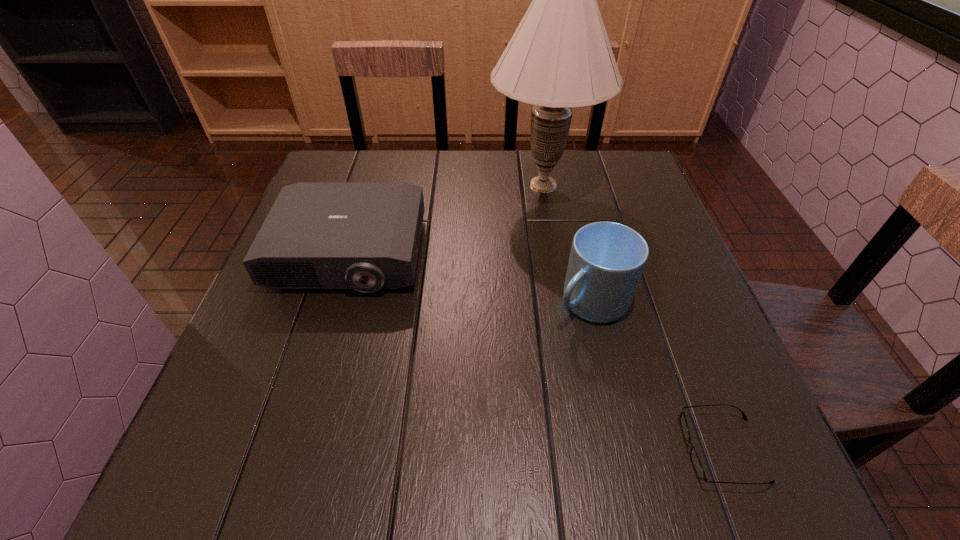
Where is `free spot that satisfies the following two spatial constraints: 1. on the front-facing side of the projector; 2. on the right side of the mug`? free spot that satisfies the following two spatial constraints: 1. on the front-facing side of the projector; 2. on the right side of the mug is located at coordinates (335, 302).

You are a GUI agent. You are given a task and a screenshot of the screen. Output one action in this format:
    pyautogui.click(x=<x>, y=<y>)
    Task: Click on the blank space that satisfies the following two spatial constraints: 1. on the front side of the mug; 2. on the right side of the lampshade
    This screenshot has width=960, height=540.
    Given the screenshot: What is the action you would take?
    pyautogui.click(x=564, y=302)

Image resolution: width=960 pixels, height=540 pixels. I want to click on vacant point that satisfies the following two spatial constraints: 1. on the front-facing side of the second tallest object; 2. on the left side of the projector, so click(335, 302).